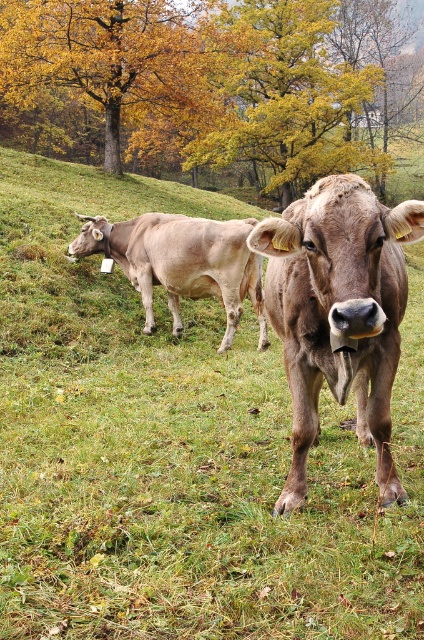
Question: Which point is closer to the camera taking this photo?

Choices:
 (A) (356, 22)
 (B) (81, 48)
 (C) (139, 218)
 (D) (303, 266)

Answer: (D)

Question: Which of the following is the farthest from the observer?

Choices:
 (A) smooth brown cow at left
 (B) yellow leafy tree at upper center
 (C) golden leafy tree at upper center
 (D) brown matte cow at center

Answer: (C)

Question: Among these points, which one is farthest from the camera?

Choices:
 (A) (354, 257)
 (B) (212, 273)
 (C) (30, 76)

Answer: (C)

Question: Can you confirm if brown matte cow at center is positioned above yellow leafy tree at upper center?

Choices:
 (A) yes
 (B) no

Answer: (B)

Question: Is yellow leafy tree at upper center wider than smooth brown cow at left?

Choices:
 (A) yes
 (B) no

Answer: (A)

Question: Does golden leafy tree at upper center appear on the right side of brown matte cow at center?

Choices:
 (A) yes
 (B) no

Answer: (B)